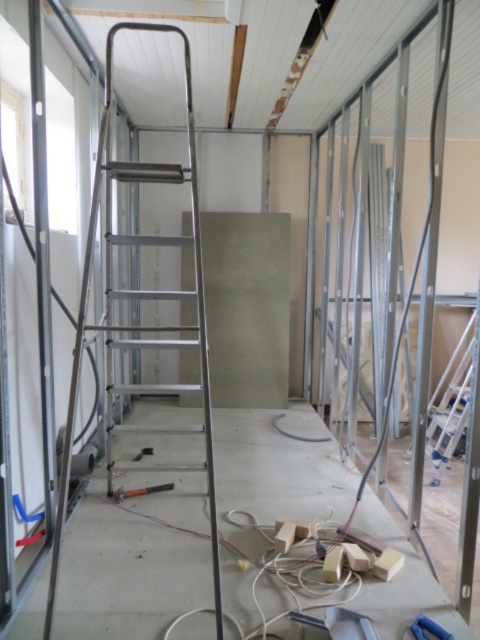
Which is more to the right, silver metallic ladder at left or black rubber hammer at center?

silver metallic ladder at left

Which is in front, point (104, 125) or point (168, 484)?

Positioned in front is point (104, 125).

The height and width of the screenshot is (640, 480). In order to click on silver metallic ladder at left in this screenshot , I will do `click(139, 298)`.

What are the coordinates of `silver metallic ladder at left` in the screenshot? It's located at (139, 298).